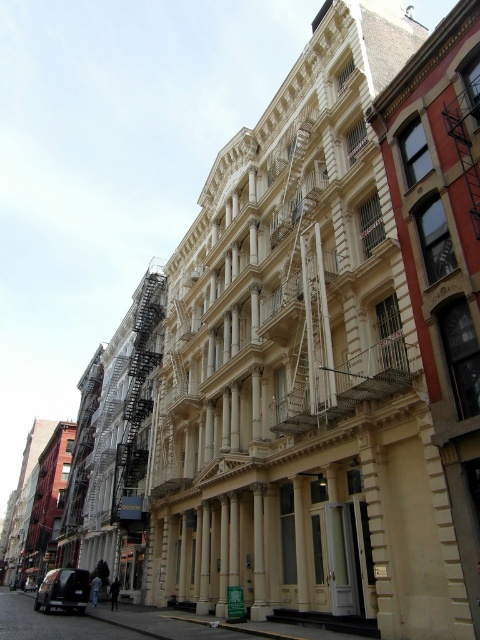
Who is positioned more to the right, black metal fire escape at left or shiny black car at lower left?

black metal fire escape at left

Can you confirm if black metal fire escape at left is taller than shiny black car at lower left?

Yes, black metal fire escape at left is taller than shiny black car at lower left.

Identify the location of black metal fire escape at left. (139, 396).

I want to click on black metal fire escape at left, so click(139, 396).